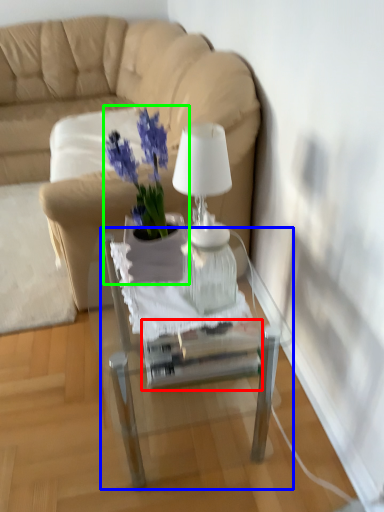
Question: Based on their relative distances, which object is nearer to glass box (highlighted by a red box)? Choose from table (highlighted by a blue box) and houseplant (highlighted by a green box).

Choices:
 (A) table
 (B) houseplant

Answer: (A)